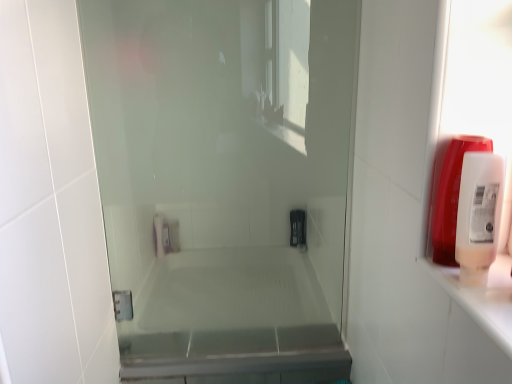
Question: Is white plastic soap dispenser at right, the 2th soap dispenser when ordered from back to front, oriented away from transparent glass shower door at center?

Choices:
 (A) no
 (B) yes

Answer: (A)

Question: From the image's perspective, would you say white plastic soap dispenser at right, the 2th soap dispenser when ordered from back to front, is positioned over transparent glass shower door at center?

Choices:
 (A) no
 (B) yes

Answer: (A)

Question: Is white plastic soap dispenser at right, the 2th soap dispenser when ordered from back to front, next to transparent glass shower door at center?

Choices:
 (A) no
 (B) yes

Answer: (A)

Question: Is white plastic soap dispenser at right, placed as the 1th soap dispenser when sorted from front to back, far away from transparent glass shower door at center?

Choices:
 (A) no
 (B) yes

Answer: (A)

Question: From a real-world perspective, is white plastic soap dispenser at right, the 2th soap dispenser when ordered from back to front, beneath transparent glass shower door at center?

Choices:
 (A) no
 (B) yes

Answer: (A)

Question: Can we say white plastic soap dispenser at right, the 2th soap dispenser when ordered from back to front, lies outside transparent glass shower door at center?

Choices:
 (A) no
 (B) yes

Answer: (B)

Question: Is white plastic soap dispenser at right, placed as the 1th soap dispenser when sorted from front to back, taller than translucent plastic soap dispenser at right, the 1th soap dispenser in the back-to-front sequence?

Choices:
 (A) yes
 (B) no

Answer: (B)

Question: Is white plastic soap dispenser at right, placed as the 1th soap dispenser when sorted from front to back, to the left of translucent plastic soap dispenser at right, the 1th soap dispenser in the back-to-front sequence, from the viewer's perspective?

Choices:
 (A) no
 (B) yes

Answer: (B)

Question: Would you say white plastic soap dispenser at right, the 2th soap dispenser when ordered from back to front, is a long distance from translucent plastic soap dispenser at right, which is the 2th soap dispenser in front-to-back order?

Choices:
 (A) no
 (B) yes

Answer: (A)

Question: Is white plastic soap dispenser at right, the 2th soap dispenser when ordered from back to front, at the right side of translucent plastic soap dispenser at right, which is the 2th soap dispenser in front-to-back order?

Choices:
 (A) yes
 (B) no

Answer: (B)

Question: From a real-world perspective, does white plastic soap dispenser at right, placed as the 1th soap dispenser when sorted from front to back, sit lower than translucent plastic soap dispenser at right, which is the 2th soap dispenser in front-to-back order?

Choices:
 (A) no
 (B) yes

Answer: (B)

Question: Does white plastic soap dispenser at right, placed as the 1th soap dispenser when sorted from front to back, contain translucent plastic soap dispenser at right, which is the 2th soap dispenser in front-to-back order?

Choices:
 (A) yes
 (B) no

Answer: (B)

Question: Is translucent plastic soap dispenser at right, which is the 2th soap dispenser in front-to-back order, at the right side of white plastic soap dispenser at right, placed as the 1th soap dispenser when sorted from front to back?

Choices:
 (A) no
 (B) yes

Answer: (B)